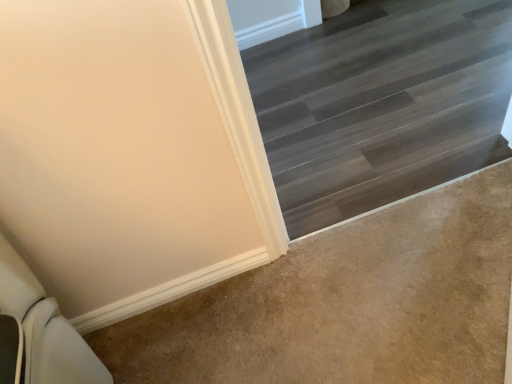
Question: Are dark wood stairs at upper right and beige carpet at lower right located far from each other?

Choices:
 (A) yes
 (B) no

Answer: (B)

Question: Is dark wood stairs at upper right to the left of beige carpet at lower right from the viewer's perspective?

Choices:
 (A) no
 (B) yes

Answer: (A)

Question: Is dark wood stairs at upper right closer to the viewer compared to beige carpet at lower right?

Choices:
 (A) yes
 (B) no

Answer: (B)

Question: From the image's perspective, is dark wood stairs at upper right located beneath beige carpet at lower right?

Choices:
 (A) yes
 (B) no

Answer: (B)

Question: From a real-world perspective, is dark wood stairs at upper right physically below beige carpet at lower right?

Choices:
 (A) yes
 (B) no

Answer: (A)

Question: Considering the relative sizes of dark wood stairs at upper right and beige carpet at lower right in the image provided, is dark wood stairs at upper right bigger than beige carpet at lower right?

Choices:
 (A) yes
 (B) no

Answer: (A)

Question: Does beige carpet at lower right come in front of dark wood stairs at upper right?

Choices:
 (A) no
 (B) yes

Answer: (B)

Question: Considering the relative sizes of beige carpet at lower right and dark wood stairs at upper right in the image provided, is beige carpet at lower right thinner than dark wood stairs at upper right?

Choices:
 (A) yes
 (B) no

Answer: (A)

Question: Is beige carpet at lower right at the left side of dark wood stairs at upper right?

Choices:
 (A) no
 (B) yes

Answer: (B)

Question: From the image's perspective, would you say beige carpet at lower right is shown under dark wood stairs at upper right?

Choices:
 (A) no
 (B) yes

Answer: (B)

Question: Is the depth of beige carpet at lower right greater than that of dark wood stairs at upper right?

Choices:
 (A) no
 (B) yes

Answer: (A)

Question: Is beige carpet at lower right facing away from dark wood stairs at upper right?

Choices:
 (A) yes
 (B) no

Answer: (B)

Question: From the image's perspective, relative to dark wood stairs at upper right, is beige carpet at lower right above or below?

Choices:
 (A) above
 (B) below

Answer: (B)